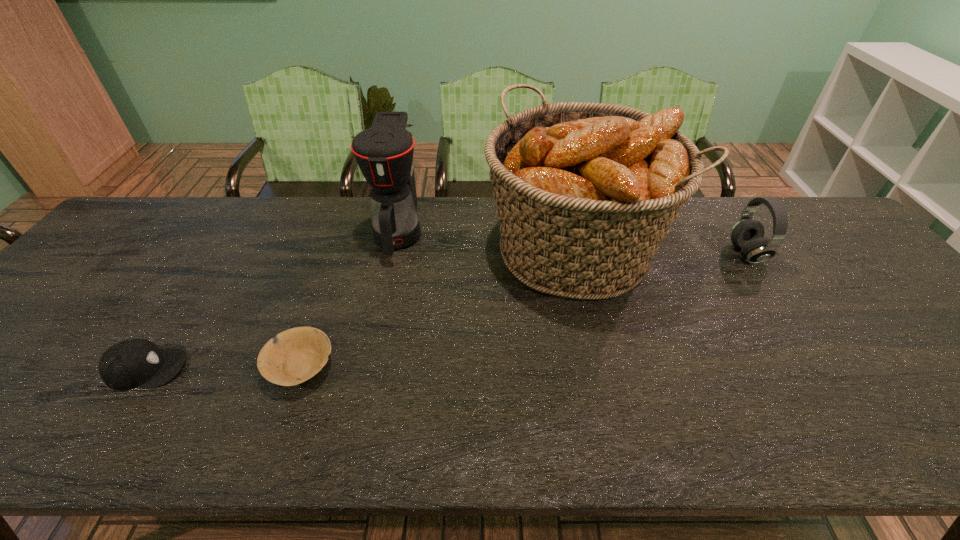
Identify the location of free space at the left edge of the desktop. The width and height of the screenshot is (960, 540). (46, 328).

I want to click on free space between the tallest object and the bowl, so click(x=437, y=308).

The image size is (960, 540). In order to click on vacant space that's between the headset and the tallest object in this screenshot , I will do `click(660, 252)`.

The height and width of the screenshot is (540, 960). What are the coordinates of `vacant area that lies between the tallest object and the rightmost object` in the screenshot? It's located at (660, 252).

This screenshot has height=540, width=960. I want to click on vacant space that is in between the tallest object and the leftmost object, so click(x=360, y=309).

Where is `empty space that is in between the coffee maker and the leftmost object`? empty space that is in between the coffee maker and the leftmost object is located at coordinates (273, 300).

Where is `free point between the headset and the second shortest object`? free point between the headset and the second shortest object is located at coordinates (446, 311).

Locate an element on the screen. vacant area that lies between the coffee maker and the second object from right to left is located at coordinates (486, 241).

In order to click on free space between the coffee maker and the fourth tallest object in this screenshot , I will do `click(273, 300)`.

Where is `vacant area between the bowl and the rightmost object`? This screenshot has width=960, height=540. vacant area between the bowl and the rightmost object is located at coordinates (523, 310).